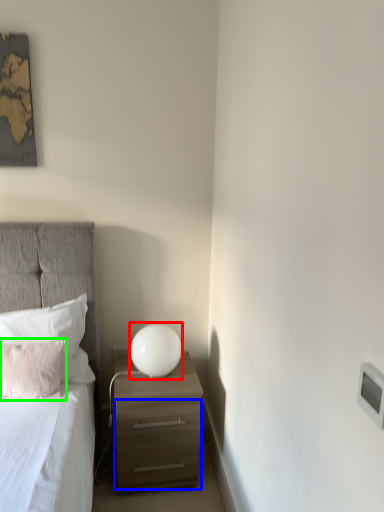
Question: Based on their relative distances, which object is farther from table lamp (highlighted by a red box)? Choose from drawer (highlighted by a blue box) and pillow (highlighted by a green box).

Choices:
 (A) drawer
 (B) pillow

Answer: (B)